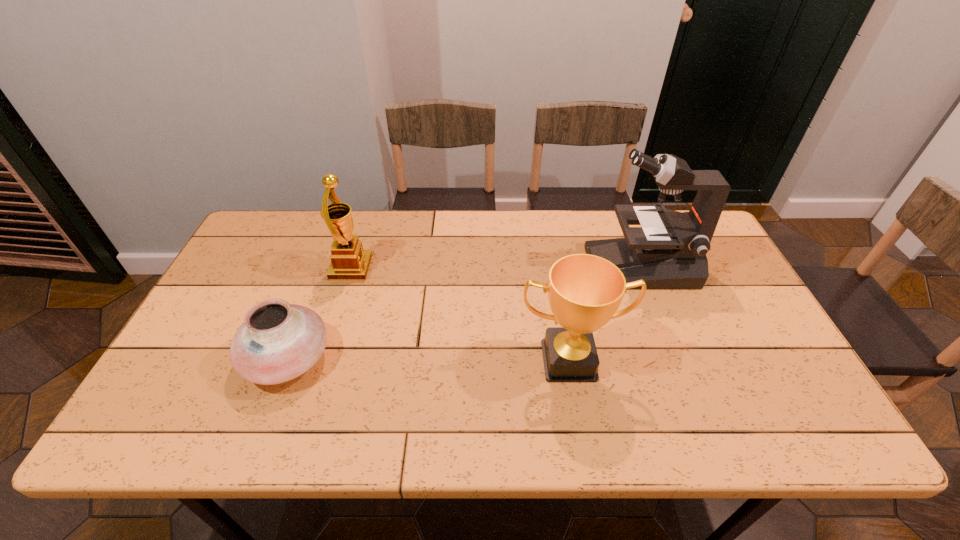
You are a GUI agent. You are given a task and a screenshot of the screen. Output one action in this format:
    pyautogui.click(x=<x>, y=<y>)
    Task: Click on the vacant space that satisfies the following two spatial constraints: 1. on the front-facing side of the left award; 2. on the front side of the shortest object
    
    Given the screenshot: What is the action you would take?
    pyautogui.click(x=324, y=359)

Identify the location of vacant space that satisfies the following two spatial constraints: 1. through the eyepieces of the tallest object; 2. on the front-facing side of the right award. (676, 360).